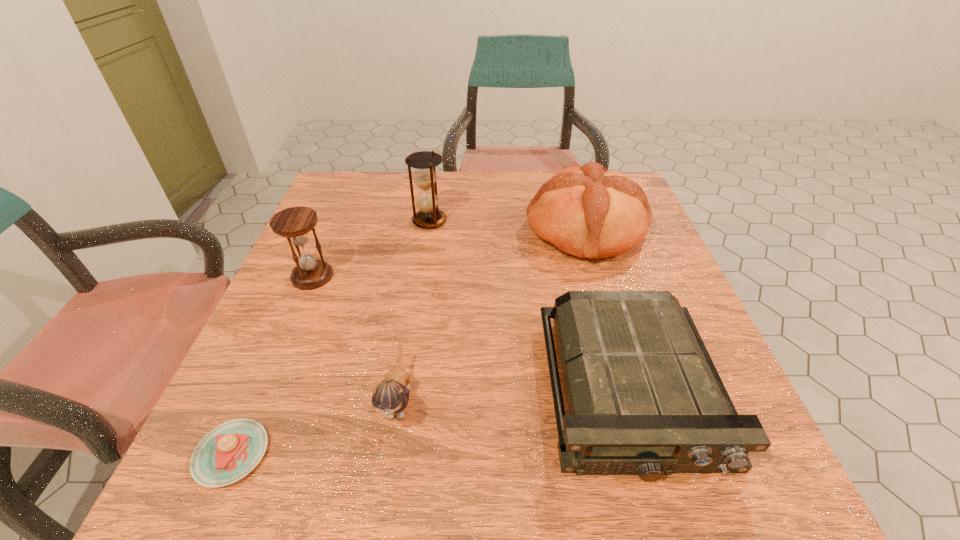
The width and height of the screenshot is (960, 540). I want to click on the right hourglass, so click(x=425, y=162).

You are a GUI agent. You are given a task and a screenshot of the screen. Output one action in this format:
    pyautogui.click(x=<x>, y=<y>)
    Task: Click on the nearer hourglass
    
    Given the screenshot: What is the action you would take?
    pyautogui.click(x=294, y=223)

The width and height of the screenshot is (960, 540). I want to click on the shorter hourglass, so click(x=294, y=223).

The image size is (960, 540). I want to click on bread, so click(587, 211).

The width and height of the screenshot is (960, 540). Find the location of `the third shortest object`. the third shortest object is located at coordinates (392, 395).

The image size is (960, 540). I want to click on the second shortest object, so click(x=644, y=397).

Image resolution: width=960 pixels, height=540 pixels. Find the location of `the shortest object`. the shortest object is located at coordinates (229, 452).

I want to click on vacant space located on the front of the right hourglass, so click(x=418, y=298).

At what (x,y) coordinates should I click in order to perform the action: click on vacant region located on the front of the nearer hourglass. Please return your answer as a coordinate pair (x, y). The image size is (960, 540). Looking at the image, I should click on (290, 328).

The height and width of the screenshot is (540, 960). In order to click on blank space located on the left of the bread in this screenshot , I will do `click(399, 230)`.